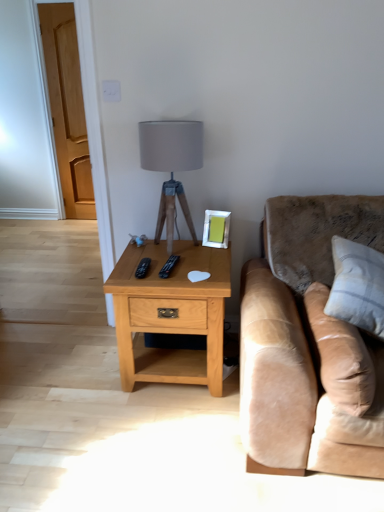
Where is `free space above light oak wood nightstand at center (from a real-world perspective)`? Image resolution: width=384 pixels, height=512 pixels. free space above light oak wood nightstand at center (from a real-world perspective) is located at coordinates (189, 260).